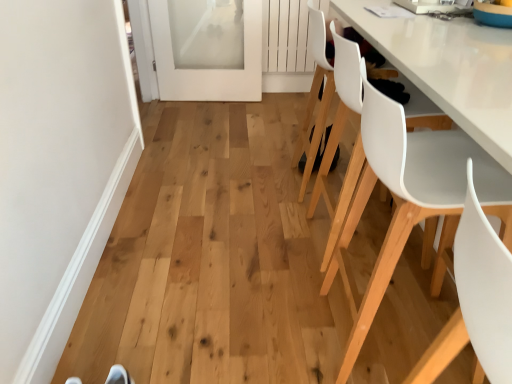
Question: Relative to white frosted glass door at upper left, is white plastic chair at right, which ranks as the 2th chair in front-to-back order, in front or behind?

Choices:
 (A) behind
 (B) front

Answer: (B)

Question: From the image's perspective, is white plastic chair at right, which is the 3th chair in back-to-front order, above or below white frosted glass door at upper left?

Choices:
 (A) below
 (B) above

Answer: (A)

Question: Estimate the real-world distances between objects in this image. Which object is farther from the white smooth door at left?

Choices:
 (A) white plastic chair at center, acting as the 3th chair starting from the front
 (B) white matte chair at lower right, which is counted as the 1th chair, starting from the front
 (C) white frosted glass door at upper left
 (D) white plastic chair at right, which is the 3th chair in back-to-front order
 (E) white matte chair at right, the 1th chair positioned from the back

Answer: (C)

Question: Estimate the real-world distances between objects in this image. Which object is farther from the white frosted glass door at upper left?

Choices:
 (A) white matte chair at lower right, marked as the fourth chair in a back-to-front arrangement
 (B) white plastic chair at center, positioned as the 2th chair in back-to-front order
 (C) white matte chair at right, the 1th chair positioned from the back
 (D) white smooth door at left
 (E) white plastic chair at right, which ranks as the 2th chair in front-to-back order

Answer: (A)